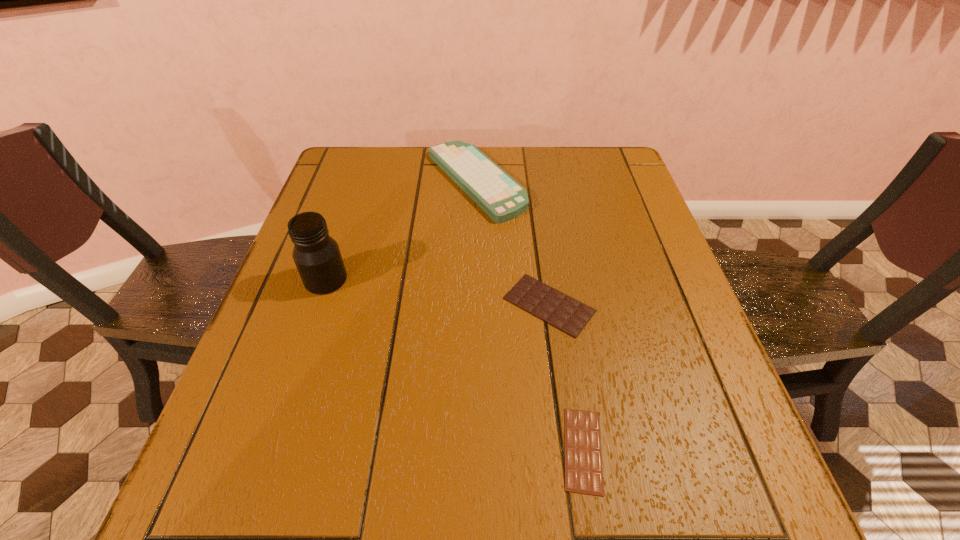
Find the location of `vacant region at the far right corner`. vacant region at the far right corner is located at coordinates (584, 161).

Where is `vacant area that lies between the second tallest object and the jar`? vacant area that lies between the second tallest object and the jar is located at coordinates (400, 231).

In order to click on free space between the jar and the taller chocolate bar in this screenshot , I will do `click(438, 292)`.

Image resolution: width=960 pixels, height=540 pixels. What are the coordinates of `empty space between the taller chocolate bar and the computer keyboard` in the screenshot? It's located at (512, 243).

The width and height of the screenshot is (960, 540). In order to click on vacant space that's between the computer keyboard and the second shortest object in this screenshot , I will do tap(512, 243).

Image resolution: width=960 pixels, height=540 pixels. I want to click on free space between the leftmost object and the farthest object, so click(400, 231).

This screenshot has height=540, width=960. I want to click on vacant space in between the farthest object and the tallest object, so click(x=400, y=231).

At what (x,y) coordinates should I click in order to perform the action: click on empty location between the nearest object and the leftmost object. Please return your answer as a coordinate pair (x, y). Looking at the image, I should click on (454, 364).

Where is `free space that is in between the second shortest object and the jar`? free space that is in between the second shortest object and the jar is located at coordinates (438, 292).

Locate an element on the screen. vacant area that lies between the farthest object and the leftmost object is located at coordinates (400, 231).